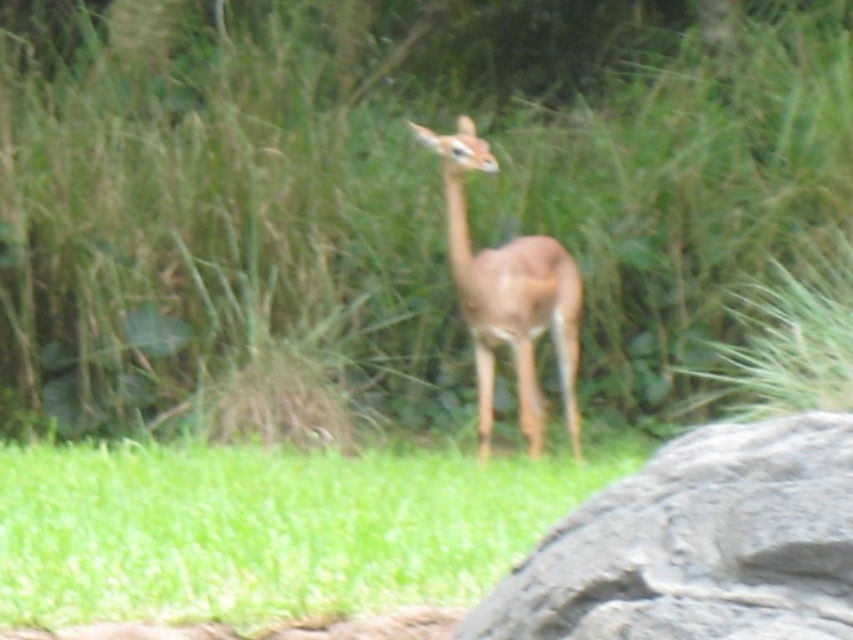
You are standing at the point with coordinates point (567, 259) and want to look towards the point with coordinates point (138, 189). Based on the scene description, will the large gray rock partially visible on the right side of the frame block your view?

The point (138, 189) is behind point (567, 259), so the large gray rock partially visible on the right side of the frame will block your view of the point (138, 189).